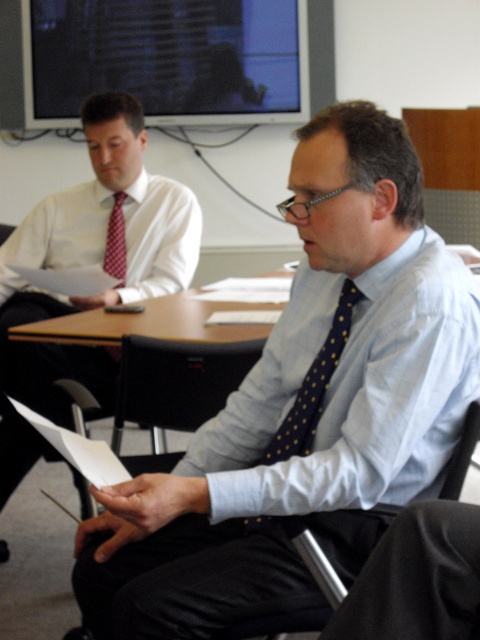
Who is shorter, polka dot tie at center or black fabric chair at center?

black fabric chair at center

Does point (477, 394) come in front of point (210, 406)?

Yes, point (477, 394) is closer to viewer.

What do you see at coordinates (303, 406) in the screenshot?
I see `polka dot tie at center` at bounding box center [303, 406].

This screenshot has height=640, width=480. I want to click on polka dot tie at center, so click(x=303, y=406).

Is matte white shirt at left smaller than red textured tie at left?

Actually, matte white shirt at left might be larger than red textured tie at left.

Describe the element at coordinates (95, 256) in the screenshot. I see `matte white shirt at left` at that location.

Who is more forward, (71,307) or (110,216)?

Point (71,307)

The height and width of the screenshot is (640, 480). What are the coordinates of `matte white shirt at left` in the screenshot? It's located at (95, 256).

Is point (126, 412) in front of point (116, 275)?

Yes, point (126, 412) is closer to viewer.

In the scene shown: Is black fabric chair at center thinner than red textured tie at left?

In fact, black fabric chair at center might be wider than red textured tie at left.

Is point (189, 344) less distant than point (121, 268)?

Yes, it is in front of point (121, 268).

I want to click on black fabric chair at center, so click(177, 381).